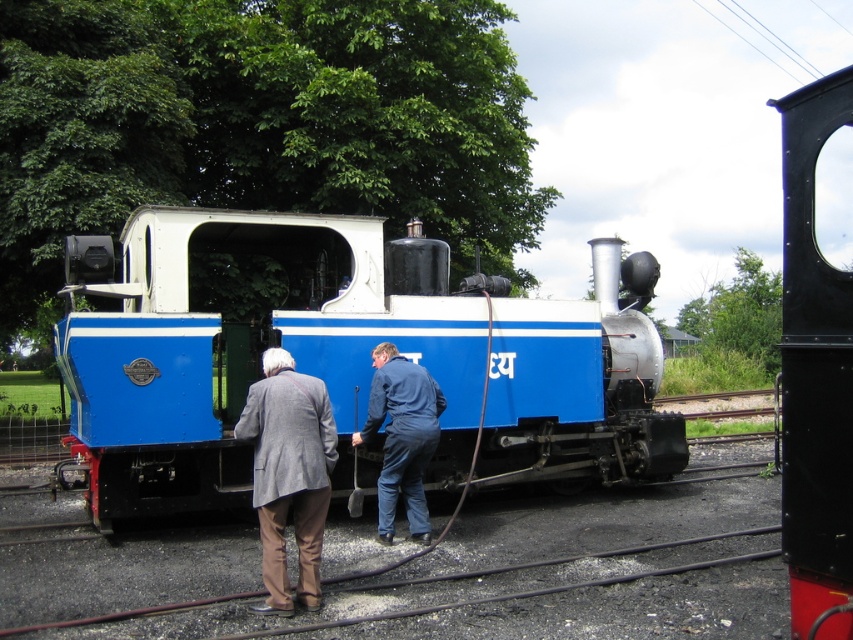
Question: Which point appears closest to the camera in this image?

Choices:
 (A) (292, 250)
 (B) (305, 403)

Answer: (B)

Question: Which object appears farthest from the camera in this image?

Choices:
 (A) black metal door at upper right
 (B) blue painted steel train at center
 (C) gray woolen coat at center

Answer: (B)

Question: Can you confirm if black metal door at upper right is bigger than gray woolen coat at center?

Choices:
 (A) yes
 (B) no

Answer: (A)

Question: Which object appears closest to the camera in this image?

Choices:
 (A) gray woolen coat at center
 (B) black metal door at upper right
 (C) blue denim jumpsuit at center

Answer: (B)

Question: Can you confirm if blue painted steel train at center is positioned to the left of black metal door at upper right?

Choices:
 (A) yes
 (B) no

Answer: (A)

Question: Can you confirm if gray woolen coat at center is positioned above blue denim jumpsuit at center?

Choices:
 (A) yes
 (B) no

Answer: (A)